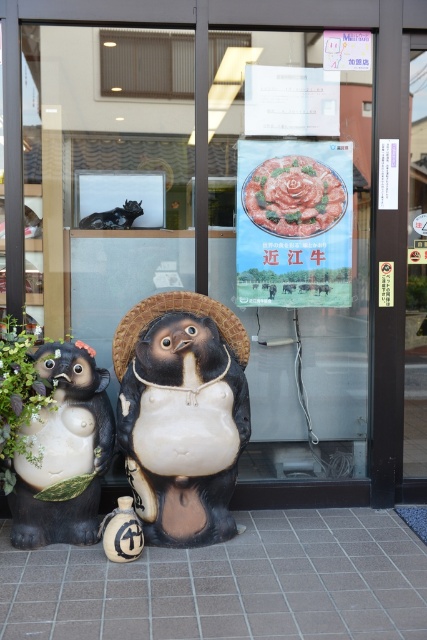
Question: Is matte ceramic penguin at center smaller than shiny black cat at upper left?

Choices:
 (A) no
 (B) yes

Answer: (A)

Question: Which object appears farthest from the camera in this image?

Choices:
 (A) transparent glass door at center
 (B) matte black bear at left

Answer: (A)

Question: Which point is closer to the camera?

Choices:
 (A) (134, 316)
 (B) (107, 218)
 (C) (298, 140)

Answer: (A)

Question: Does brown woven straw hat at center come behind shiny black cat at upper left?

Choices:
 (A) yes
 (B) no

Answer: (B)

Question: Can you confirm if matte ceramic penguin at center is thinner than shiny black cat at upper left?

Choices:
 (A) yes
 (B) no

Answer: (B)

Question: Among these points, which one is farthest from the camera?

Choices:
 (A) pos(96,228)
 (B) pos(309,99)

Answer: (A)